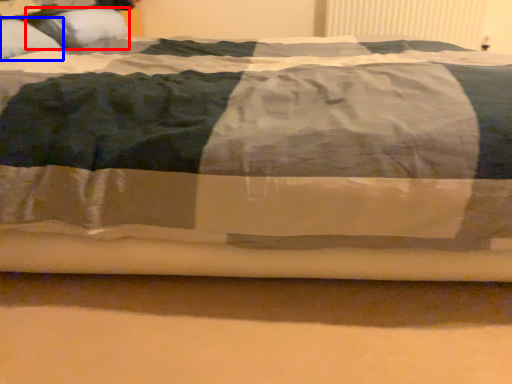
Question: Which of the following is the farthest to the observer, pillow (highlighted by a red box) or pillow (highlighted by a blue box)?

Choices:
 (A) pillow
 (B) pillow

Answer: (A)